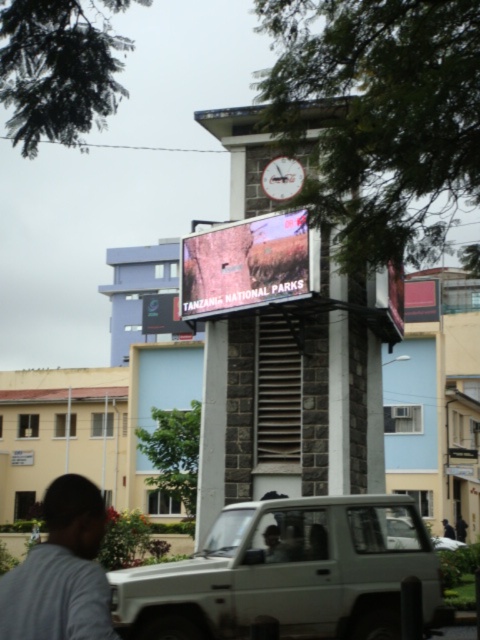
You are a tourist standing in front of the clock tower and notice the matte digital display at center and the silver metallic suv at center. Which object is positioned to the left when facing the tower?

The matte digital display at center is to the left of the silver metallic suv at center when facing the tower.